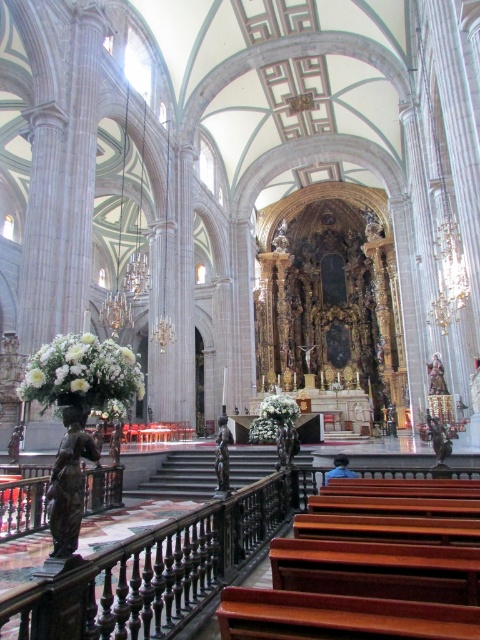
Question: Does white matte floral arrangement at left come behind white matte flower at center?

Choices:
 (A) yes
 (B) no

Answer: (A)

Question: Which of the following is the farthest from the observer?

Choices:
 (A) white matte flower at center
 (B) white floral arrangement at left
 (C) white matte floral arrangement at left

Answer: (C)

Question: Estimate the real-world distances between objects in this image. Which object is farther from the white matte flower at center?

Choices:
 (A) white matte floral arrangement at left
 (B) white matte flowers at center
 (C) white floral arrangement at left

Answer: (B)

Question: Does white matte floral arrangement at left have a larger size compared to white matte flower at center?

Choices:
 (A) yes
 (B) no

Answer: (A)

Question: Which object is farther from the camera taking this photo?

Choices:
 (A) white matte floral arrangement at left
 (B) white floral arrangement at left
 (C) white matte flower at center

Answer: (A)

Question: Is white matte flowers at center smaller than white matte floral arrangement at left?

Choices:
 (A) yes
 (B) no

Answer: (B)